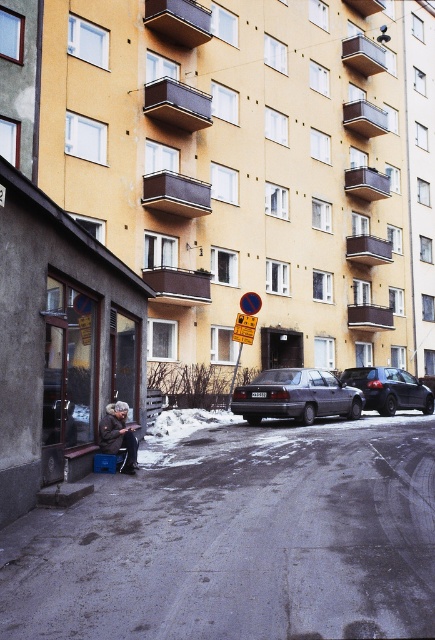
You are a delivery person trying to locate the shop entrance. You see the gray woolen coat at lower left and the yellow plastic sign at center. Which object is closer to the entrance of the shop?

The gray woolen coat at lower left is closer to the entrance of the shop since it is located below the yellow plastic sign at center, which is typically placed above the entrance for visibility.

Consider the image. You are a delivery person who needs to park your motorcycle between the matte gray sedan at center and the yellow plastic sign at center. Can you fit your motorcycle there if your motorcycle is 0.8 meters wide?

The matte gray sedan at center might be wider than yellow plastic sign at center, so there is insufficient information to determine if the space between them is wide enough for the motorcycle. Please check the actual width of the sedan and the sign first.